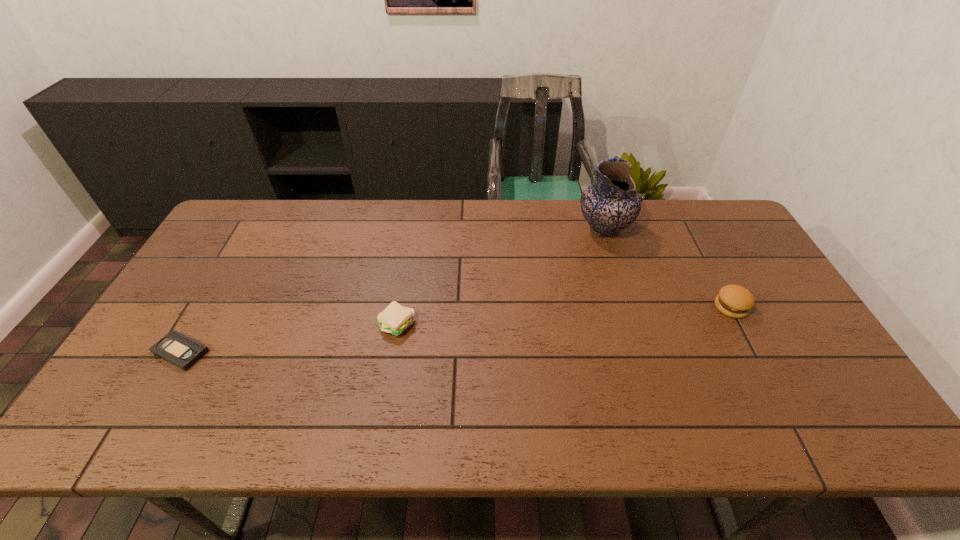
Where is `unoccupied position between the shortest object and the hamburger`? unoccupied position between the shortest object and the hamburger is located at coordinates (456, 329).

At what (x,y) coordinates should I click in order to perform the action: click on object that stands as the second closest to the videotape. Please return your answer as a coordinate pair (x, y). Looking at the image, I should click on (611, 204).

Identify the location of object that stands as the closest to the second shortest object. The height and width of the screenshot is (540, 960). (183, 352).

At what (x,y) coordinates should I click in order to perform the action: click on free space that satisfies the following two spatial constraints: 1. on the back side of the hamburger; 2. on the left side of the shortest object. Please return your answer as a coordinate pair (x, y). The height and width of the screenshot is (540, 960). Looking at the image, I should click on (206, 307).

At what (x,y) coordinates should I click in order to perform the action: click on vacant point that satisfies the following two spatial constraints: 1. on the back side of the shortest object; 2. on the left side of the tallest object. Please return your answer as a coordinate pair (x, y). Image resolution: width=960 pixels, height=540 pixels. Looking at the image, I should click on (252, 230).

Find the location of `vacant space that satisfies the following two spatial constraints: 1. on the back side of the third object from left to right; 2. on the left side of the videotape`. vacant space that satisfies the following two spatial constraints: 1. on the back side of the third object from left to right; 2. on the left side of the videotape is located at coordinates (252, 230).

Locate an element on the screen. blank space that satisfies the following two spatial constraints: 1. on the back side of the second object from left to right; 2. on the left side of the videotape is located at coordinates (196, 326).